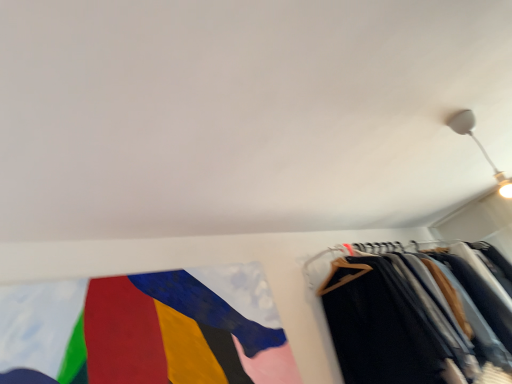
Question: Does dark gray wool trousers at right have a larger size compared to textured fabric flag at lower left?

Choices:
 (A) yes
 (B) no

Answer: (A)

Question: Considering the relative sizes of dark gray wool trousers at right and textured fabric flag at lower left in the image provided, is dark gray wool trousers at right taller than textured fabric flag at lower left?

Choices:
 (A) no
 (B) yes

Answer: (B)

Question: Does dark gray wool trousers at right turn towards textured fabric flag at lower left?

Choices:
 (A) no
 (B) yes

Answer: (A)

Question: Is dark gray wool trousers at right smaller than textured fabric flag at lower left?

Choices:
 (A) yes
 (B) no

Answer: (B)

Question: Is dark gray wool trousers at right next to textured fabric flag at lower left?

Choices:
 (A) yes
 (B) no

Answer: (B)

Question: From a real-world perspective, is dark gray wool trousers at right below textured fabric flag at lower left?

Choices:
 (A) yes
 (B) no

Answer: (A)

Question: Is textured fabric flag at lower left beside dark gray wool trousers at right?

Choices:
 (A) no
 (B) yes

Answer: (A)

Question: Is textured fabric flag at lower left outside of dark gray wool trousers at right?

Choices:
 (A) no
 (B) yes

Answer: (B)

Question: Is textured fabric flag at lower left smaller than dark gray wool trousers at right?

Choices:
 (A) yes
 (B) no

Answer: (A)

Question: From the image's perspective, does textured fabric flag at lower left appear lower than dark gray wool trousers at right?

Choices:
 (A) no
 (B) yes

Answer: (A)

Question: Is the position of textured fabric flag at lower left less distant than that of dark gray wool trousers at right?

Choices:
 (A) yes
 (B) no

Answer: (A)

Question: From a real-world perspective, is textured fabric flag at lower left below dark gray wool trousers at right?

Choices:
 (A) no
 (B) yes

Answer: (A)

Question: From a real-world perspective, is white glossy light fixture at upper right physically below dark gray wool trousers at right?

Choices:
 (A) yes
 (B) no

Answer: (B)